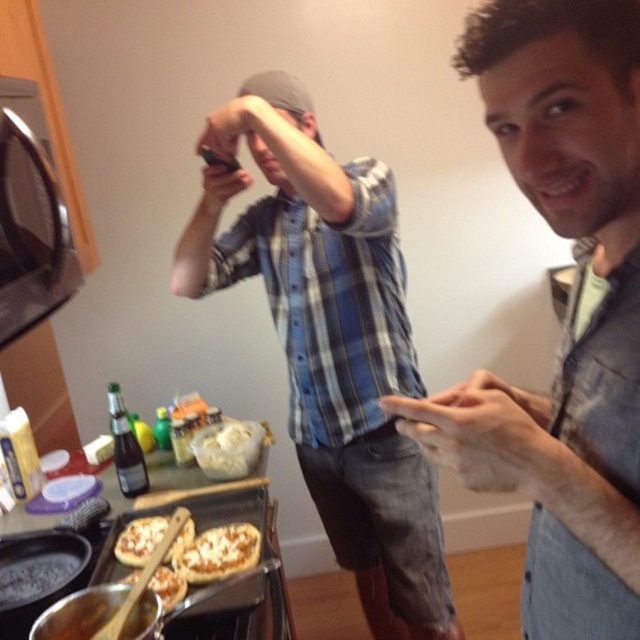
You are a food delivery person who needs to pick up two pizzas from the kitchen. The cheesy pizza at center and the golden crispy pizza at lower left are on the counter. Which pizza should you grab first if you want to reach the one closer to you?

The golden crispy pizza at lower left is closer to you, so you should grab it first.